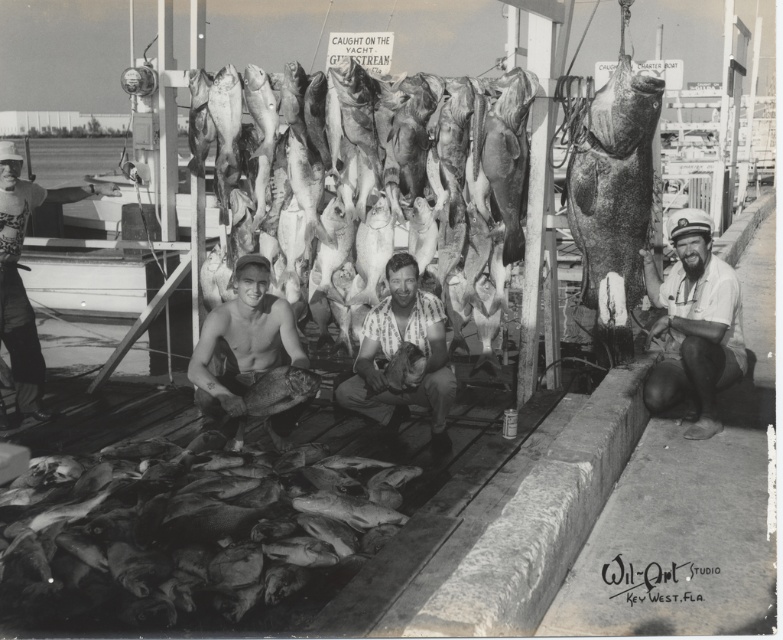
Does smooth skin fish at lower left have a greater height compared to shiny silver fish at right?

Incorrect, smooth skin fish at lower left's height is not larger of shiny silver fish at right's.

Is point (192, 502) in front of point (648, 124)?

Yes, it is.

Does point (367, 490) come in front of point (621, 32)?

Yes, it is.

This screenshot has height=640, width=783. What are the coordinates of `smooth skin fish at lower left` in the screenshot? It's located at (188, 538).

How distant is shiny silver fish at center from smooth skin man at center?

shiny silver fish at center and smooth skin man at center are 3.38 feet apart from each other.

Who is higher up, shiny silver fish at center or smooth skin man at center?

shiny silver fish at center

Who is more forward, (363, 230) or (266, 369)?

Point (266, 369) is more forward.

Where is `shiny silver fish at center`? This screenshot has width=783, height=640. shiny silver fish at center is located at coordinates (370, 177).

The width and height of the screenshot is (783, 640). What are the coordinates of `shiny silver fish at right` in the screenshot? It's located at pyautogui.click(x=614, y=193).

Is point (648, 84) positioned behind point (727, 342)?

No, it is not.

Which is behind, point (568, 227) or point (709, 240)?

The point (568, 227) is more distant.

The width and height of the screenshot is (783, 640). In order to click on shiny silver fish at right in this screenshot , I will do `click(614, 193)`.